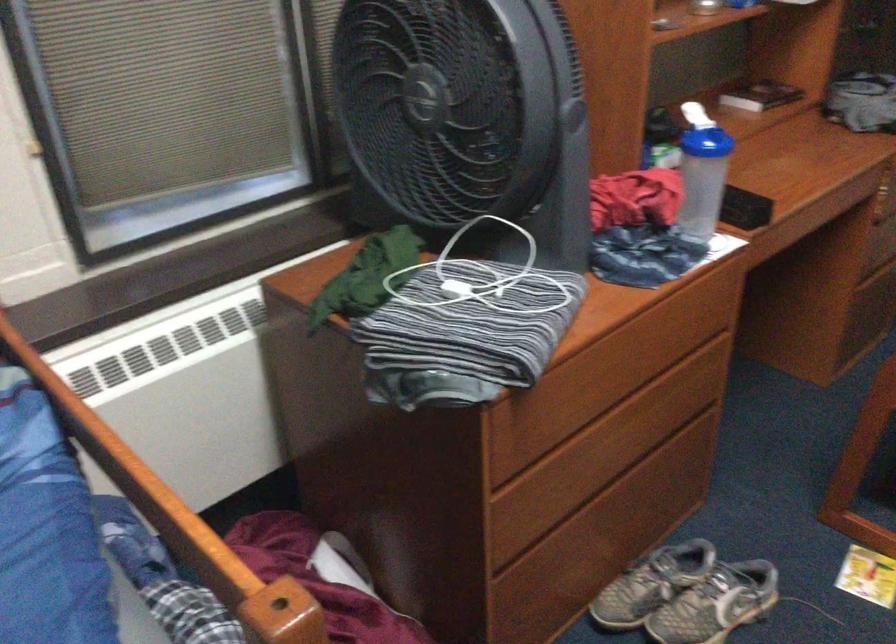
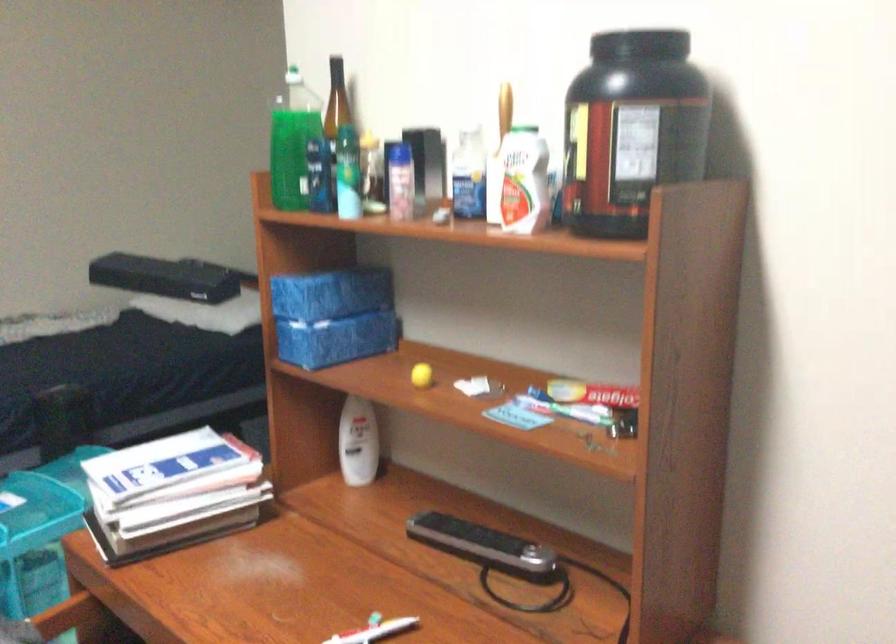
Question: How did the camera likely rotate?

Choices:
 (A) Left
 (B) Right
 (C) Up
 (D) Down

Answer: (B)